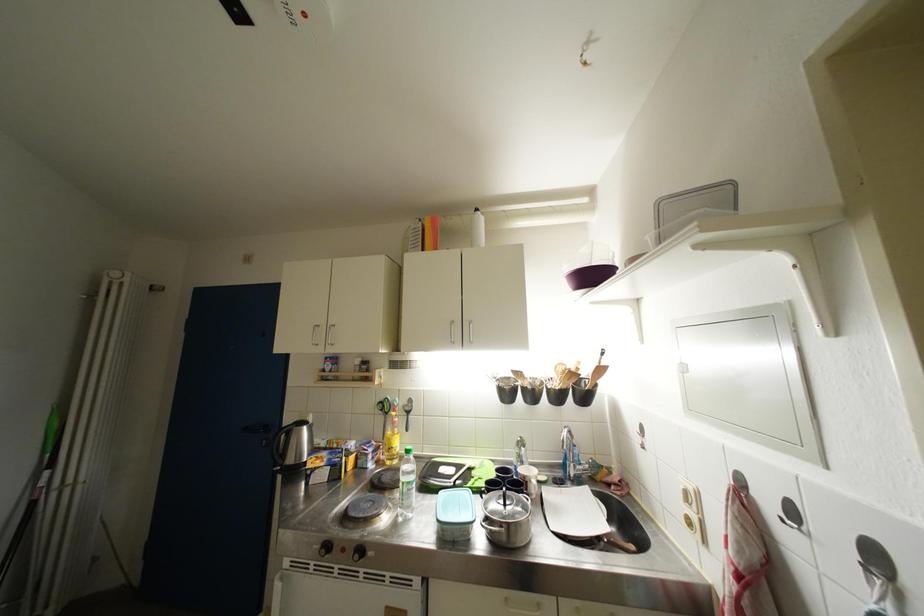
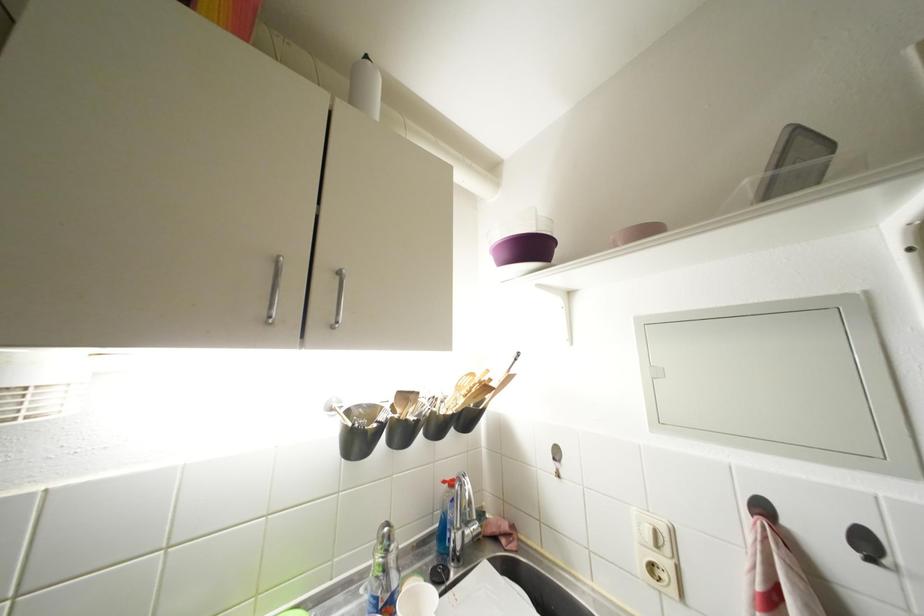
The point at (695, 506) is marked in the first image. Where is the corresponding point in the second image?

(663, 549)